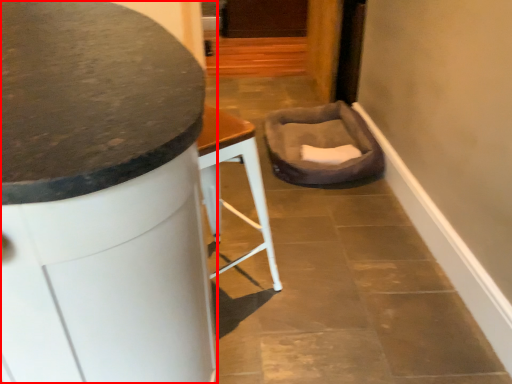
Question: Observing the image, what is the correct spatial positioning of furniture (annotated by the red box) in reference to swivel chair?

Choices:
 (A) left
 (B) right

Answer: (A)